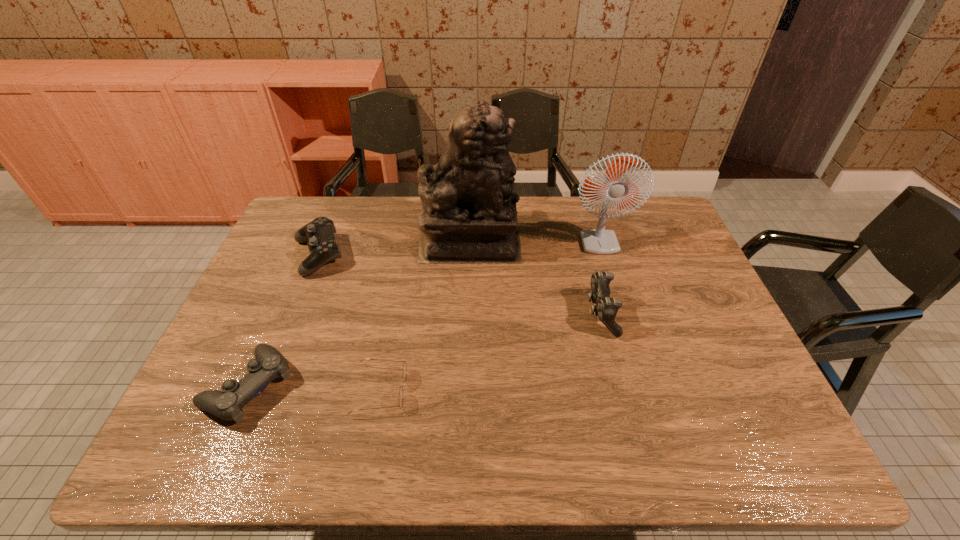
Identify the location of the tallest object. (469, 215).

Find the location of a particular element. the second tallest object is located at coordinates (595, 241).

The width and height of the screenshot is (960, 540). Find the location of `the rightmost control`. the rightmost control is located at coordinates (606, 308).

The image size is (960, 540). In order to click on the fourth shortest object in this screenshot , I will do `click(606, 308)`.

Identify the location of the fourth tallest object. Image resolution: width=960 pixels, height=540 pixels. (319, 234).

This screenshot has width=960, height=540. What are the coordinates of `the farthest control` in the screenshot? It's located at (319, 234).

In order to click on the shortest control in this screenshot , I will do `click(269, 364)`.

Where is `the nearest control`? Image resolution: width=960 pixels, height=540 pixels. the nearest control is located at coordinates (269, 364).

The image size is (960, 540). Identify the location of spectacles. (404, 365).

Image resolution: width=960 pixels, height=540 pixels. Identify the location of free region located 0.080m on the front-facing side of the tallest object. 545,242.